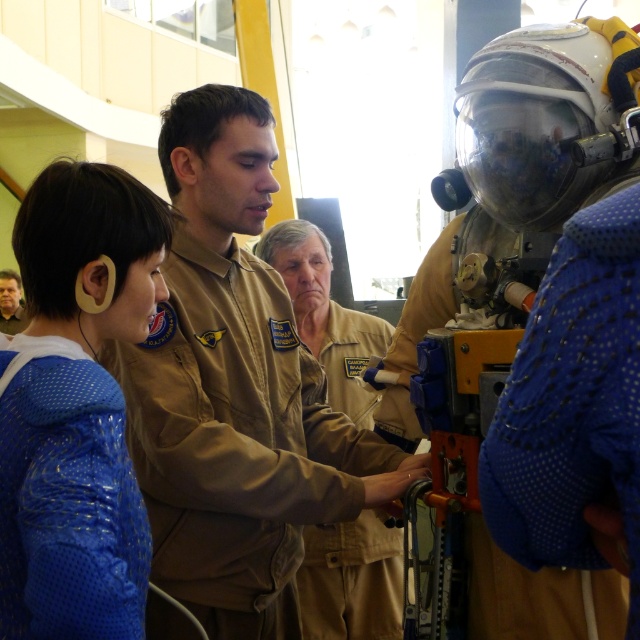
You are a visitor at this event and want to approach the person in the tan uniform at center to ask a question. Which direction should you move relative to the brown leather jacket at lower left?

The tan uniform at center is below the brown leather jacket at lower left, so you should move downward from the brown leather jacket at lower left to reach the tan uniform at center.

You are a security guard at the facility and need to verify the positions of two team members. According to the scene, where is the tan uniform at center in relation to the brown leather jacket at lower left?

The tan uniform at center is to the right of the brown leather jacket at lower left.